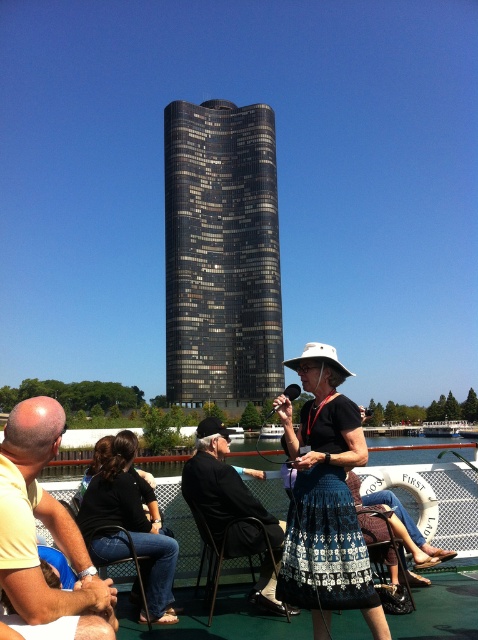
You are a passenger on the boat and want to take a photo of both the black glass building at center and the white mesh ferry at center. Which one should you position to the left in your camera frame?

You should position the black glass building at center to the left in your camera frame because it is already located to the left of the white mesh ferry at center in the scene.

You are standing on the deck of the boat and want to reach the lifebuoy marked First and Lavatory. The point you are currently at is point (148, 563). Can you estimate whether the lifebuoy is within a 50 meter radius from your current position?

The distance between point (148, 563) and the viewer is 47.52 meters, which is within the 50 meter radius. Therefore, the lifebuoy marked First and Lavatory is within the 50 meter radius from your current position.